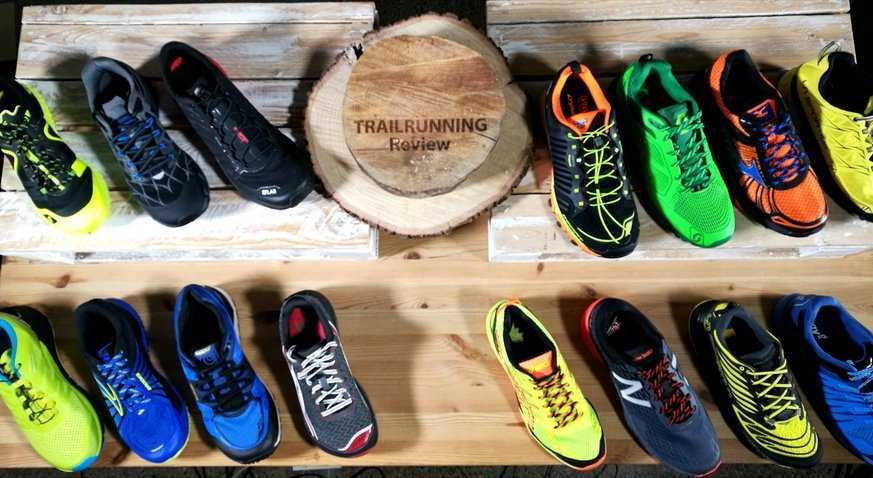
The width and height of the screenshot is (873, 478). What are the coordinates of `wood planke` in the screenshot? It's located at (235, 228), (191, 150), (272, 94), (290, 41), (287, 10), (528, 9), (535, 39), (526, 185), (525, 245), (416, 374).